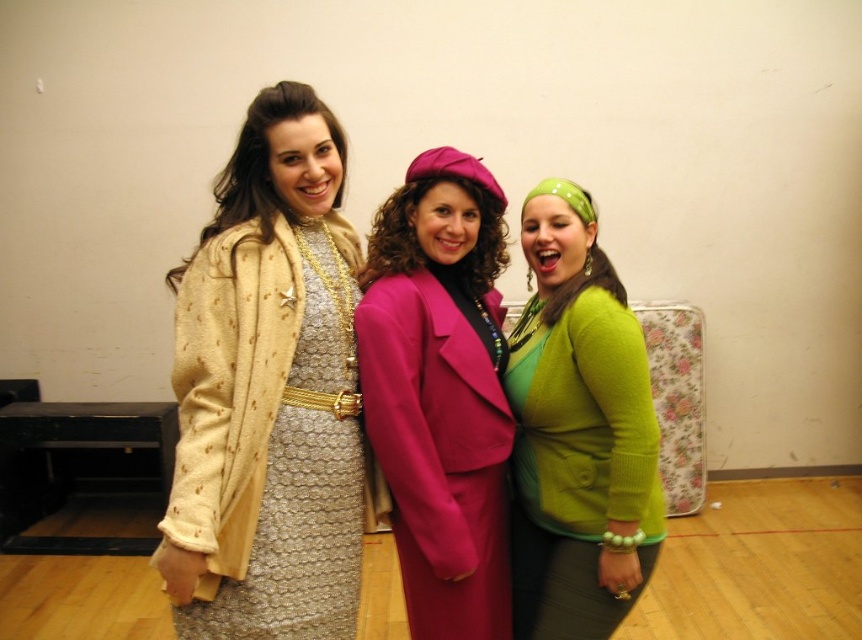
Question: Which of these objects is positioned farthest from the green fuzzy sweater at center?

Choices:
 (A) gold textured dress at center
 (B) matte pink coat at center

Answer: (A)

Question: Which of the following is the closest to the observer?

Choices:
 (A) (534, 576)
 (B) (222, 330)
 (C) (426, 595)

Answer: (B)

Question: Is gold textured dress at center bigger than green fuzzy sweater at center?

Choices:
 (A) yes
 (B) no

Answer: (A)

Question: Can you confirm if gold textured dress at center is positioned to the left of matte pink coat at center?

Choices:
 (A) no
 (B) yes

Answer: (B)

Question: Does gold textured dress at center appear under green fuzzy sweater at center?

Choices:
 (A) yes
 (B) no

Answer: (A)

Question: Which of the following is the closest to the observer?

Choices:
 (A) green fuzzy sweater at center
 (B) matte pink coat at center

Answer: (A)